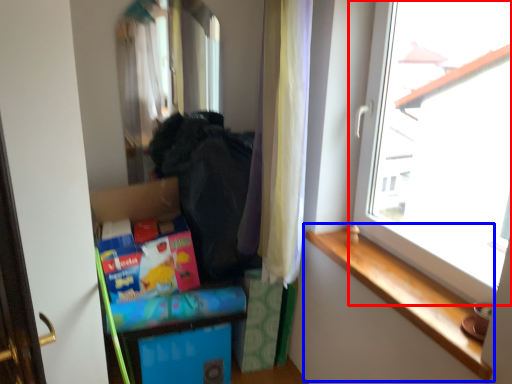
Question: Which point is closer to the camera, window (highlighted by a red box) or window sill (highlighted by a blue box)?

Choices:
 (A) window
 (B) window sill

Answer: (A)